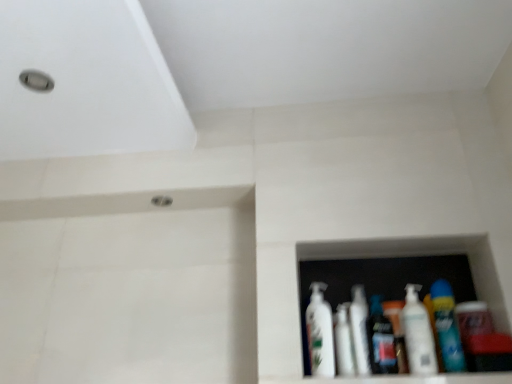
Question: Looking at the image, does white glossy mouthwash at center, acting as the second mouthwash starting from the left, seem bigger or smaller compared to white glossy bottle at center, acting as the second toiletry starting from the left?

Choices:
 (A) small
 (B) big

Answer: (A)

Question: Is white glossy mouthwash at center, acting as the second mouthwash starting from the left, in front of or behind white glossy bottle at center, which is counted as the first toiletry, starting from the right, in the image?

Choices:
 (A) front
 (B) behind

Answer: (A)

Question: Which object is positioned closest to the white glossy bottle at center, which appears as the first mouthwash when viewed from the left?

Choices:
 (A) white glossy bottle at center, the first bottle when ordered from right to left
 (B) white glossy ledge at lower right
 (C) white glossy bottle at center, which is counted as the first toiletry, starting from the right
 (D) white glossy bottle at center, the 2th bottle when ordered from right to left
 (E) white glossy mouthwash at center, acting as the second mouthwash starting from the left

Answer: (E)

Question: Estimate the real-world distances between objects in this image. Which object is closer to the white glossy bottle at center, which is counted as the first toiletry, starting from the right?

Choices:
 (A) white plastic bottle at center, positioned as the first bottle in left-to-right order
 (B) white glossy bottle at center, which appears as the first mouthwash when viewed from the left
 (C) white glossy ledge at lower right
 (D) white glossy bottle at center, the 2th bottle when ordered from left to right
 (E) white glossy mouthwash at center, acting as the second mouthwash starting from the left

Answer: (D)